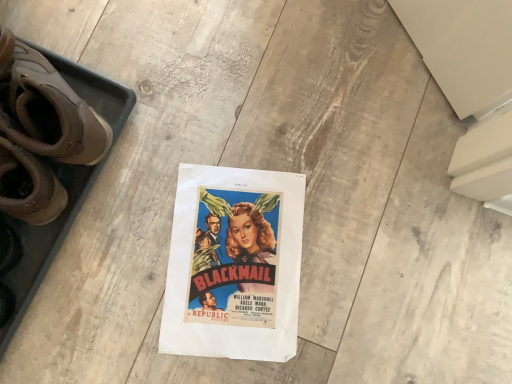
Locate an element on the screen. free point above matte paper poster at center (from a real-world perspective) is located at coordinates (233, 266).